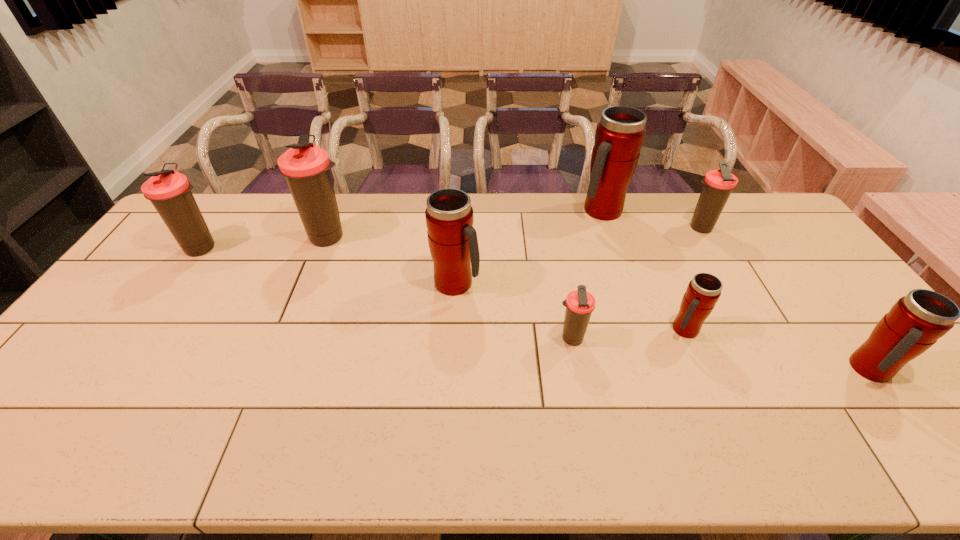
Where is `the closest red thermos bottle to the third smallest brown thermos bottle`? This screenshot has width=960, height=540. the closest red thermos bottle to the third smallest brown thermos bottle is located at coordinates (452, 239).

Locate which brown thermos bottle is the fourth closest to the biggest red thermos bottle. Please provide its 2D coordinates. Your answer should be formatted as a tuple, i.e. [(x, y)], where the tuple contains the x and y coordinates of a point satisfying the conditions above.

[(169, 191)]

Select which brown thermos bottle appears as the second closest to the fourth nearest object. Please provide its 2D coordinates. Your answer should be formatted as a tuple, i.e. [(x, y)], where the tuple contains the x and y coordinates of a point satisfying the conditions above.

[(306, 167)]

Image resolution: width=960 pixels, height=540 pixels. Identify the location of free space that satisfies the following two spatial constraints: 1. on the side with the handle of the fifth farthest object; 2. on the left side of the smallest brown thermos bottle. (453, 339).